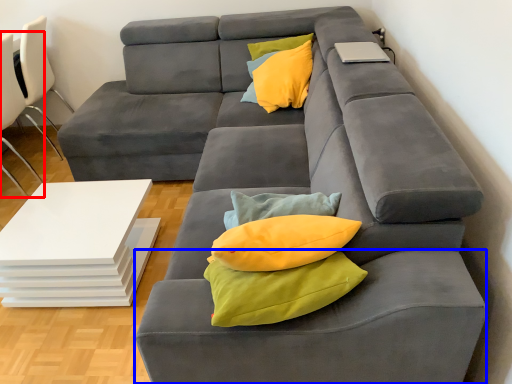
Question: Which object appears farthest to the camera in this image, chair (highlighted by a red box) or footrest (highlighted by a blue box)?

Choices:
 (A) chair
 (B) footrest

Answer: (A)